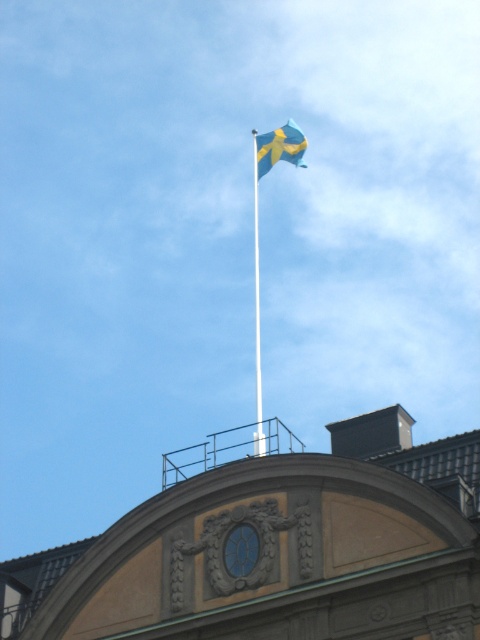
You are standing in front of a classical building with a Swedish flag. The flag is at a specific coordinate. If you want to estimate the flag position relative to the building, where would you say the blue fabric flag at upper center is located?

The blue fabric flag at upper center is located at coordinate point (279, 147).

You are a photographer trying to capture the Swedish flag and its flagpole in a single shot. Given that the blue fabric flag at upper center is smaller than the white smooth flag pole at upper center, how does the size of the flag compare to the flag pole in the image?

The blue fabric flag at upper center is smaller in size compared to the white smooth flag pole at upper center.

You are a photographer trying to capture the Swedish flag and its flagpole in a single shot. Given that the blue fabric flag at upper center is above the white smooth flag pole at upper center, will you need to adjust your camera angle to include both in the frame?

Yes, you need to adjust your camera angle to include both the blue fabric flag at upper center and the white smooth flag pole at upper center in the frame since the flag is positioned above the pole.